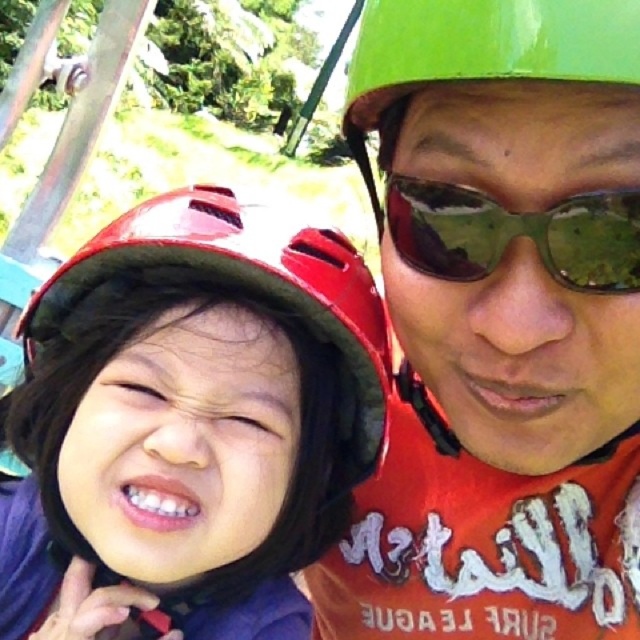
You are navigating a virtual reality game where you must move from point A to point B. The game shows you two coordinates in the scene, point A at point (173, 234) and point B at point (458, 360). According to the scene description, which point is closer to the camera?

Point A at point (173, 234) is closer to the camera because it is in front of point B at point (458, 360).

You are designing a storage box for adventure gear. The glossy red helmet at left and the green reflective sunglasses at upper center need to be placed side by side. Based on their sizes, which object should be placed first in the box to ensure both fit properly?

The glossy red helmet at left has a larger width than the green reflective sunglasses at upper center, so it should be placed first in the storage box to accommodate its size before adding the sunglasses.